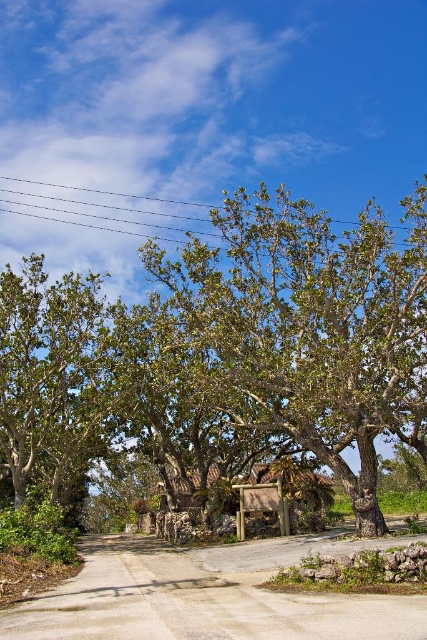
Which is in front, point (72, 342) or point (69, 220)?

Point (72, 342)

Which of these two, green leafy tree at left or black wire at upper center, stands shorter?

With less height is black wire at upper center.

Find the location of a particular element. The image size is (427, 640). green leafy tree at left is located at coordinates (53, 378).

Consider the image. Is green leafy tree at center in front of green leafy tree at left?

Yes, green leafy tree at center is in front of green leafy tree at left.

Can you confirm if green leafy tree at center is thinner than green leafy tree at left?

No, green leafy tree at center is not thinner than green leafy tree at left.

Is point (257, 403) closer to viewer compared to point (22, 408)?

Yes, point (257, 403) is closer to viewer.

The height and width of the screenshot is (640, 427). I want to click on green leafy tree at center, so click(x=228, y=349).

Who is higher up, green leafy tree at center or black wire at upper center?

black wire at upper center is above.

Is green leafy tree at center shorter than black wire at upper center?

In fact, green leafy tree at center may be taller than black wire at upper center.

Image resolution: width=427 pixels, height=640 pixels. What do you see at coordinates (228, 349) in the screenshot?
I see `green leafy tree at center` at bounding box center [228, 349].

This screenshot has width=427, height=640. What are the coordinates of `green leafy tree at center` in the screenshot? It's located at (228, 349).